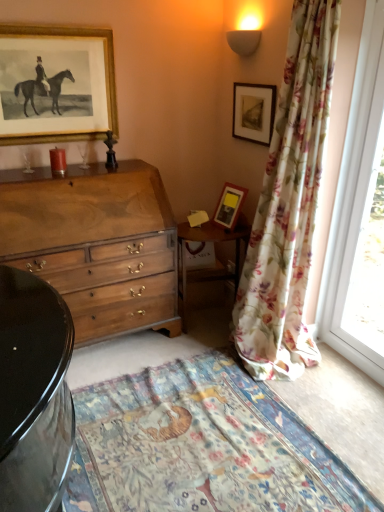
Question: Is matte wooden picture frame at upper right, the second picture frame in the right-to-left sequence, positioned before transparent glass window at right?

Choices:
 (A) no
 (B) yes

Answer: (A)

Question: From the image's perspective, is matte wooden picture frame at upper right, the second picture frame from the left, below transparent glass window at right?

Choices:
 (A) no
 (B) yes

Answer: (A)

Question: Is matte wooden picture frame at upper right, the second picture frame from the left, next to transparent glass window at right and touching it?

Choices:
 (A) yes
 (B) no

Answer: (B)

Question: Can you confirm if matte wooden picture frame at upper right, the second picture frame in the right-to-left sequence, is shorter than transparent glass window at right?

Choices:
 (A) no
 (B) yes

Answer: (B)

Question: Is matte wooden picture frame at upper right, the second picture frame from the left, further to camera compared to transparent glass window at right?

Choices:
 (A) no
 (B) yes

Answer: (B)

Question: From a real-world perspective, is floral cotton blanket at lower center physically located above or below floral fabric curtain at right?

Choices:
 (A) below
 (B) above

Answer: (A)

Question: Visually, is floral cotton blanket at lower center positioned to the left or to the right of floral fabric curtain at right?

Choices:
 (A) right
 (B) left

Answer: (B)

Question: From the image's perspective, relative to floral fabric curtain at right, is floral cotton blanket at lower center above or below?

Choices:
 (A) above
 (B) below

Answer: (B)

Question: Is floral cotton blanket at lower center bigger or smaller than floral fabric curtain at right?

Choices:
 (A) small
 (B) big

Answer: (A)

Question: Looking at their shapes, would you say transparent glass window at right is wider or thinner than matte black picture frame at upper right, the 1th picture frame positioned from the right?

Choices:
 (A) wide
 (B) thin

Answer: (A)

Question: Considering the relative positions of transparent glass window at right and matte black picture frame at upper right, the 1th picture frame positioned from the right, in the image provided, is transparent glass window at right to the left or to the right of matte black picture frame at upper right, the 1th picture frame positioned from the right,?

Choices:
 (A) right
 (B) left

Answer: (A)

Question: Is transparent glass window at right inside the boundaries of matte black picture frame at upper right, acting as the third picture frame starting from the left, or outside?

Choices:
 (A) inside
 (B) outside

Answer: (B)

Question: From the image's perspective, is transparent glass window at right positioned above or below matte black picture frame at upper right, the 1th picture frame positioned from the right?

Choices:
 (A) below
 (B) above

Answer: (A)

Question: Does point (258, 295) appear closer or farther from the camera than point (72, 114)?

Choices:
 (A) closer
 (B) farther

Answer: (A)

Question: From a real-world perspective, is floral fabric curtain at right physically located above or below gold-framed print at upper left, which ranks as the 3th picture frame in right-to-left order?

Choices:
 (A) below
 (B) above

Answer: (A)